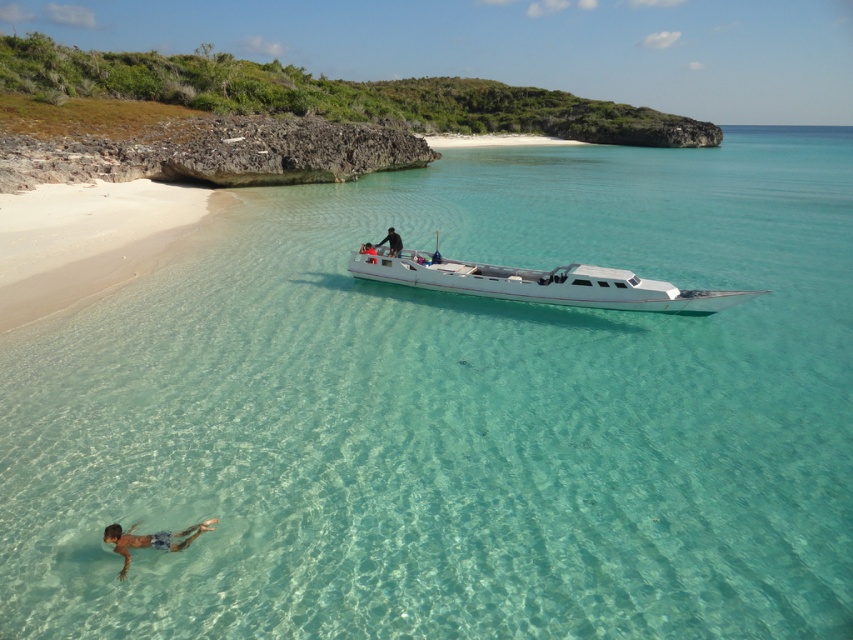
Question: Is white glossy boat at center below dark blue fabric shirt at center?

Choices:
 (A) no
 (B) yes

Answer: (B)

Question: Among these objects, which one is farthest from the camera?

Choices:
 (A) tan skin person at lower left
 (B) white glossy boat at center
 (C) dark blue fabric shirt at center
 (D) white sand beach at lower left

Answer: (B)

Question: Estimate the real-world distances between objects in this image. Which object is farther from the white sand beach at lower left?

Choices:
 (A) white glossy boat at center
 (B) tan skin person at lower left

Answer: (A)

Question: Which of the following is the closest to the observer?

Choices:
 (A) white sand beach at lower left
 (B) dark blue fabric shirt at center
 (C) white glossy boat at center

Answer: (A)

Question: Is white sand beach at lower left above tan skin person at lower left?

Choices:
 (A) yes
 (B) no

Answer: (A)

Question: Can you confirm if white glossy boat at center is wider than tan skin person at lower left?

Choices:
 (A) no
 (B) yes

Answer: (A)